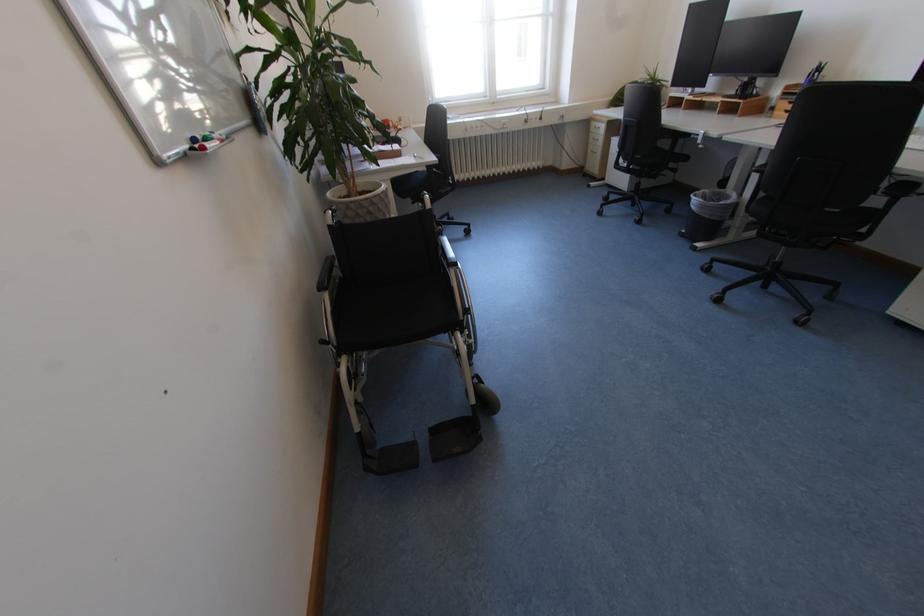
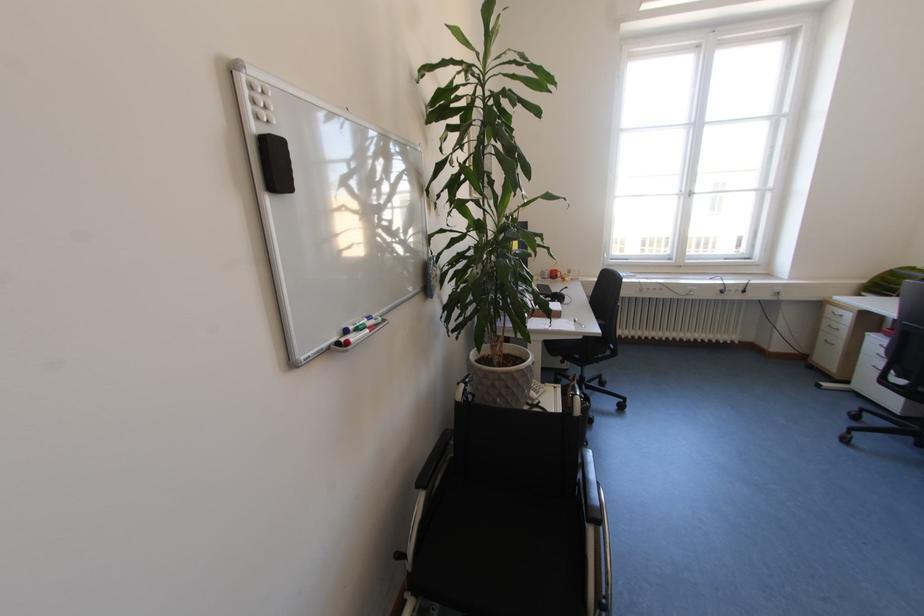
The point at (x=213, y=140) is marked in the first image. Where is the corresponding point in the second image?

(366, 330)